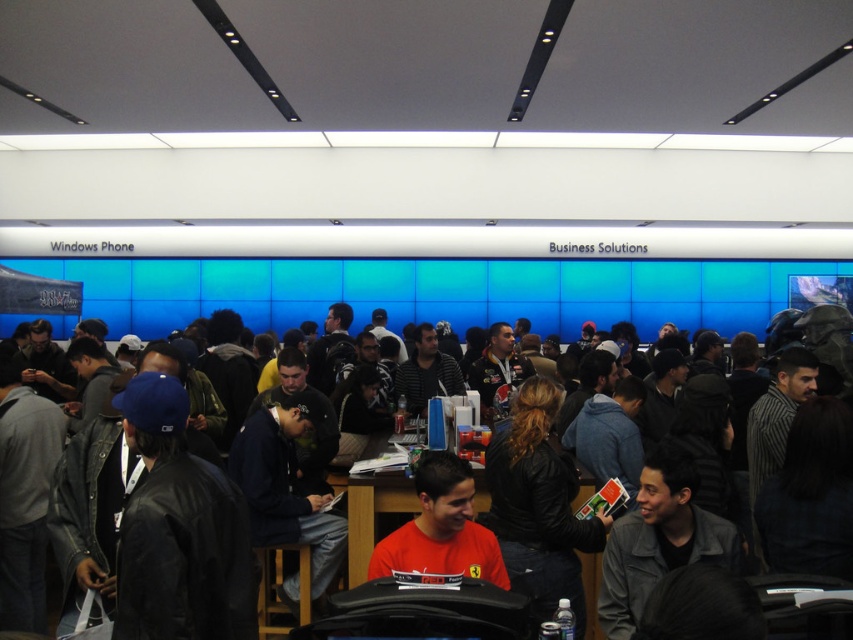
You are standing in the tech store and want to locate two points marked in the scene. Which of the two points, point (471, 522) or point (482, 506), is closer to you?

Point (471, 522) is closer to the viewer than point (482, 506).